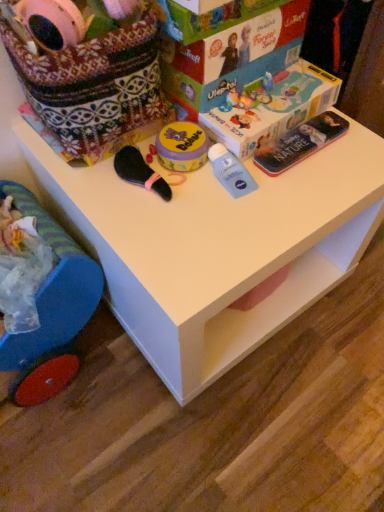
Question: Is matte cardboard box at upper center surrounding matte plastic magazine at upper right?

Choices:
 (A) yes
 (B) no

Answer: (B)

Question: Is matte cardboard box at upper center facing towards matte plastic magazine at upper right?

Choices:
 (A) yes
 (B) no

Answer: (B)

Question: Is matte plastic magazine at upper right at the back of matte cardboard box at upper center?

Choices:
 (A) yes
 (B) no

Answer: (B)

Question: Are matte cardboard box at upper center and matte plastic magazine at upper right far apart?

Choices:
 (A) yes
 (B) no

Answer: (B)

Question: Can you confirm if matte cardboard box at upper center is positioned to the right of matte plastic magazine at upper right?

Choices:
 (A) no
 (B) yes

Answer: (A)

Question: Is matte cardboard box at upper center closer to camera compared to matte plastic magazine at upper right?

Choices:
 (A) yes
 (B) no

Answer: (A)

Question: From the image's perspective, is blue plastic toy at lower left on matte plastic magazine at upper right?

Choices:
 (A) no
 (B) yes

Answer: (A)

Question: Is blue plastic toy at lower left positioned behind matte plastic magazine at upper right?

Choices:
 (A) yes
 (B) no

Answer: (B)

Question: Does blue plastic toy at lower left have a smaller size compared to matte plastic magazine at upper right?

Choices:
 (A) no
 (B) yes

Answer: (A)

Question: Is blue plastic toy at lower left facing away from matte plastic magazine at upper right?

Choices:
 (A) yes
 (B) no

Answer: (A)

Question: Is blue plastic toy at lower left with matte plastic magazine at upper right?

Choices:
 (A) yes
 (B) no

Answer: (B)

Question: Considering the relative sizes of blue plastic toy at lower left and matte plastic magazine at upper right in the image provided, is blue plastic toy at lower left bigger than matte plastic magazine at upper right?

Choices:
 (A) yes
 (B) no

Answer: (A)

Question: Is blue plastic toy at lower left positioned behind matte cardboard box at upper center?

Choices:
 (A) yes
 (B) no

Answer: (B)